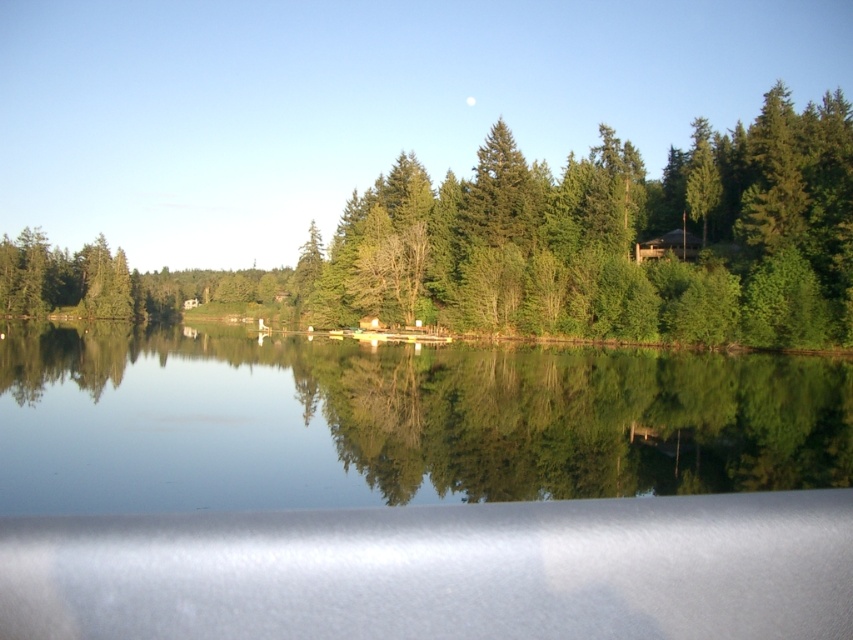
You are driving a car and want to park it near the brown wooden cabin at upper right. The parking space available is exactly 10 meters long. Can the car reach the cabin from its current position at the transparent glass car window at lower center? Consider the distance between them.

The transparent glass car window at lower center and brown wooden cabin at upper right are 71.65 meters apart. Since the parking space is only 10 meters long, the car cannot reach the cabin from its current position as the distance is much greater than the available parking space.